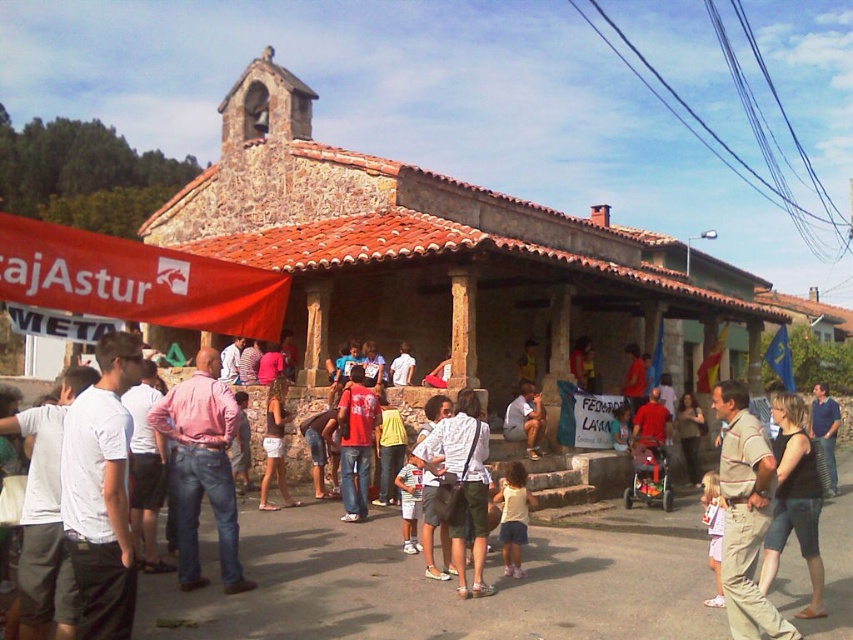
Question: Considering the relative positions of red fabric banner at left and pink cotton shirt at center in the image provided, where is red fabric banner at left located with respect to pink cotton shirt at center?

Choices:
 (A) above
 (B) below

Answer: (A)

Question: Which point appears closest to the camera in this image?

Choices:
 (A) (154, 321)
 (B) (799, 412)
 (C) (270, 413)

Answer: (B)

Question: Which point is closer to the camera?

Choices:
 (A) (343, 496)
 (B) (227, 148)

Answer: (A)

Question: Does red cotton t-shirt at center appear on the right side of brown fabric shorts at center?

Choices:
 (A) no
 (B) yes

Answer: (B)

Question: Which of the following is the closest to the observer?

Choices:
 (A) white cotton t-shirt at center
 (B) brown fabric shorts at center

Answer: (A)

Question: Does brown fabric shorts at center appear on the right side of light blue denim shorts at center?

Choices:
 (A) yes
 (B) no

Answer: (B)